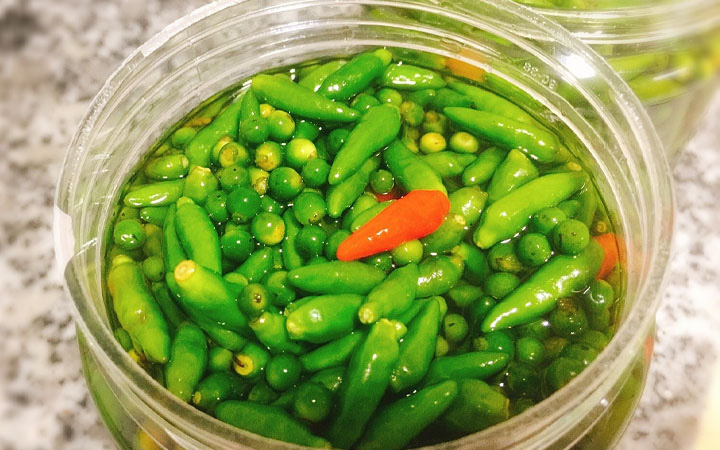
Where is `canning jars`? The image size is (720, 450). canning jars is located at coordinates (642, 163), (636, 30).